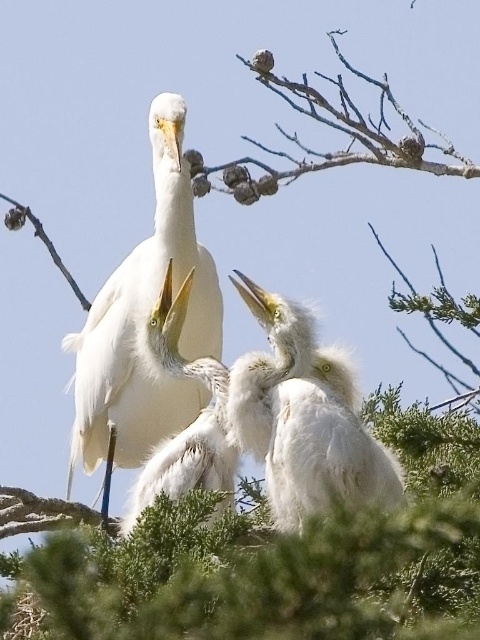
Question: Does white feathered bird at center lie in front of white fluffy bird at center?

Choices:
 (A) yes
 (B) no

Answer: (B)

Question: Which of the following is the farthest from the observer?

Choices:
 (A) (363, 472)
 (B) (151, 353)
 (C) (96, 436)

Answer: (C)

Question: Which of the following is the farthest from the observer?

Choices:
 (A) (325, 392)
 (B) (148, 492)

Answer: (B)

Question: Among these points, which one is nearest to the camera?

Choices:
 (A) (179, 186)
 (B) (343, 368)

Answer: (B)

Question: Does white feathered bird at center have a lesser width compared to white fluffy bird at center?

Choices:
 (A) no
 (B) yes

Answer: (A)

Question: Can you confirm if white fluffy bird at center is positioned below white matte bird at center?

Choices:
 (A) no
 (B) yes

Answer: (B)